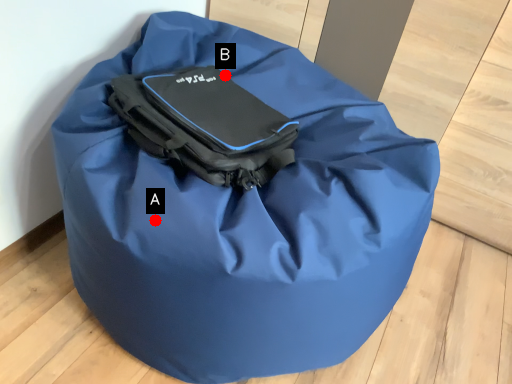
Question: Two points are circled on the image, labeled by A and B beside each circle. Among these points, which one is farthest from the camera?

Choices:
 (A) A is further
 (B) B is further

Answer: (B)